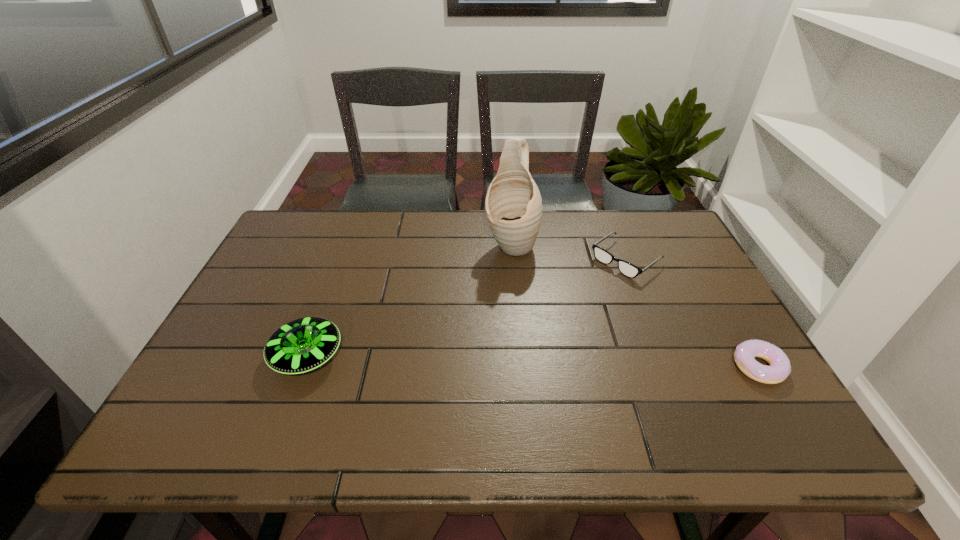
Image resolution: width=960 pixels, height=540 pixels. I want to click on vacant area situated on the front-facing side of the spectacles, so click(546, 320).

The width and height of the screenshot is (960, 540). Identify the location of blank space located at the spout of the pitcher. (468, 361).

Locate an element on the screen. Image resolution: width=960 pixels, height=540 pixels. free space located 0.320m at the spout of the pitcher is located at coordinates (475, 345).

Identify the location of free region located at the spout of the pitcher. (497, 284).

Locate an element on the screen. The image size is (960, 540). spectacles positioned at the far edge is located at coordinates (629, 270).

Where is `pitcher situated at the far edge`? Image resolution: width=960 pixels, height=540 pixels. pitcher situated at the far edge is located at coordinates (513, 204).

Where is `saucer that is at the near edge`? The height and width of the screenshot is (540, 960). saucer that is at the near edge is located at coordinates (302, 345).

Where is `doughnut located at the near edge`? doughnut located at the near edge is located at coordinates (745, 353).

Where is `object that is at the left edge`? Image resolution: width=960 pixels, height=540 pixels. object that is at the left edge is located at coordinates (302, 345).

The width and height of the screenshot is (960, 540). I want to click on doughnut present at the right edge, so coord(745,353).